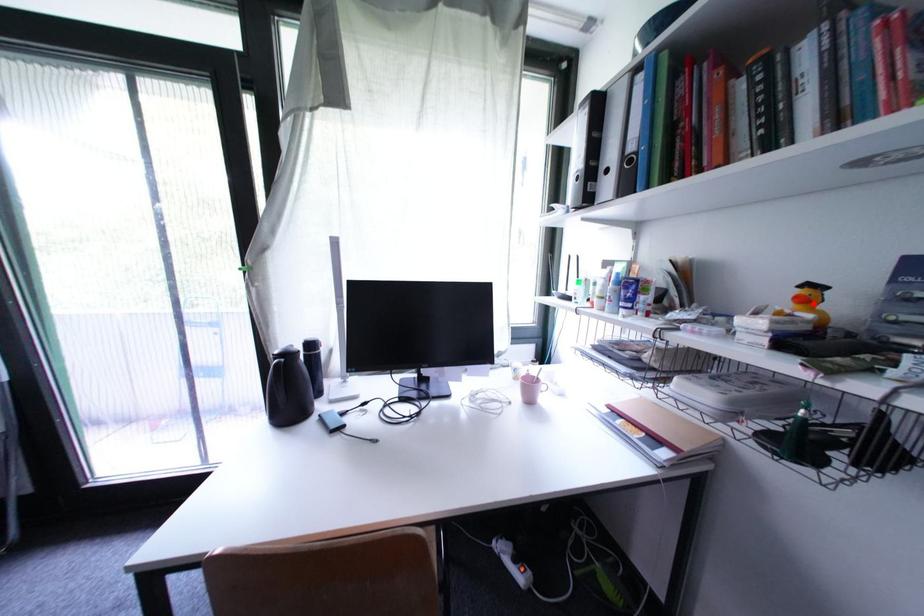
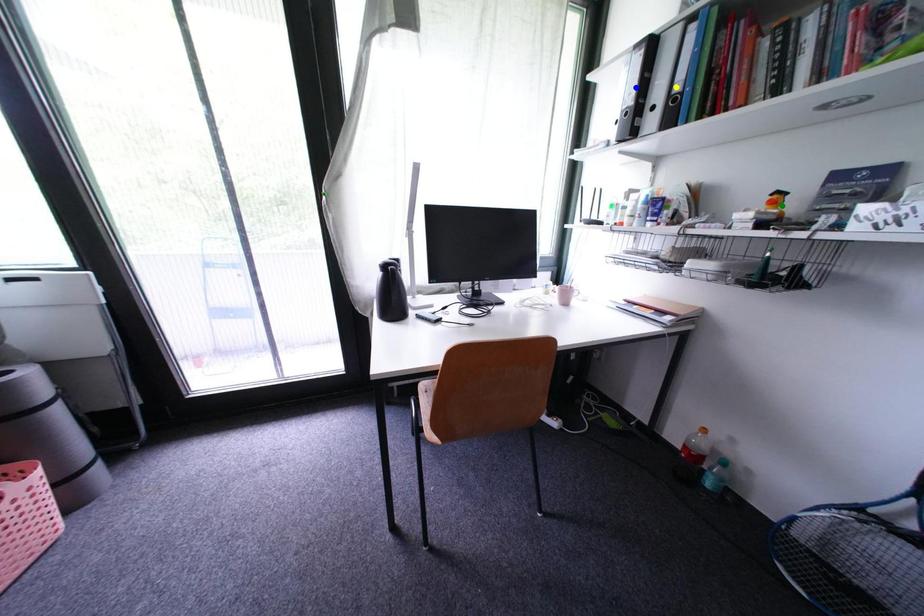
Question: I am providing you with two images of the same scene from different viewpoints. A red point is marked on the first image. You are given multiple points on the second image. In image 2, which mark is for the same physical point as the one in image 1?

Choices:
 (A) yellow point
 (B) green point
 (C) blue point

Answer: (B)